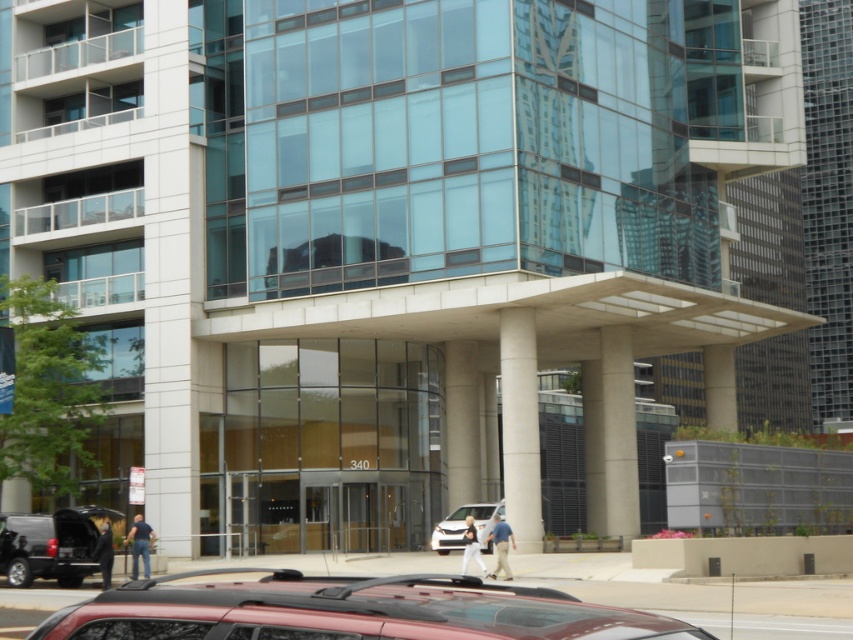
You are a delivery driver who needs to park your vehicle in the parking lot near the entrance of the building. You see a shiny red suv at lower center and a white matte van at center. Which vehicle is blocking your path to the parking spot?

The shiny red suv at lower center is positioned over the white matte van at center, so the shiny red suv at lower center is blocking the path to the parking spot.

You are standing in front of the building and want to park your shiny red suv at lower center. The parking space you want to use is 3 meters long. Can you fit your vehicle into the space?

The distance between you and the shiny red suv at lower center is 3.30 meters, so yes, the parking space of 3 meters is sufficient to fit the vehicle.

You are a delivery driver approaching the entrance of the building. You need to park your shiny red suv at lower center near the white marble pillar at center. Considering the size difference between them, will your vehicle fit in the parking spot designated for vehicles smaller than the pillar?

The shiny red suv at lower center is larger in size than the white marble pillar at center. Since the parking spot is designated for vehicles smaller than the pillar, the suv will not fit in the designated parking spot.